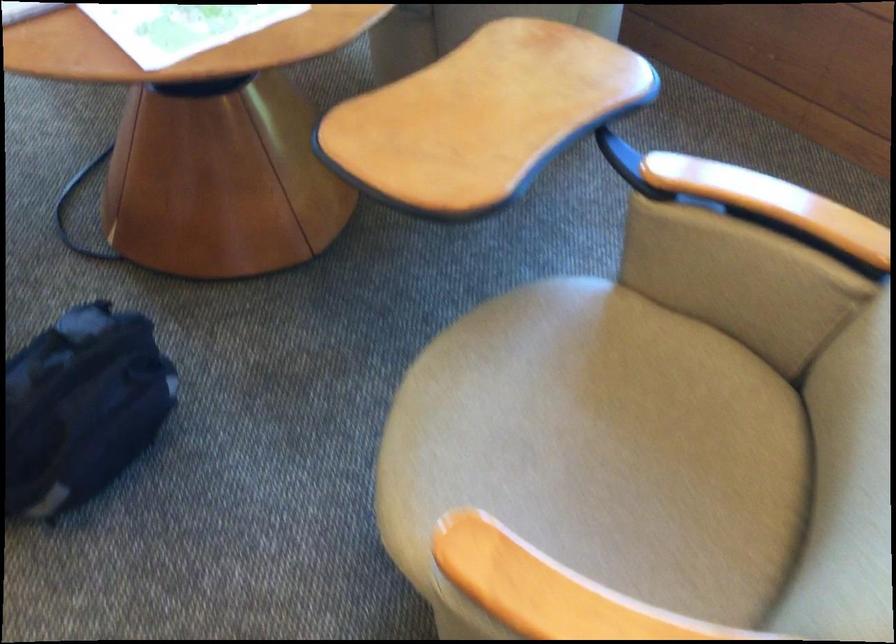
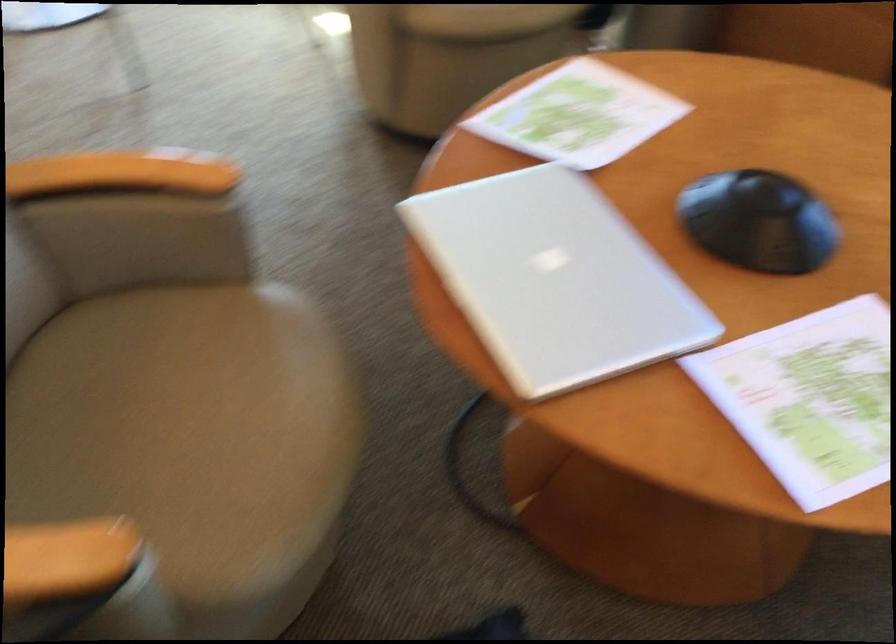
The images are taken continuously from a first-person perspective. In which direction are you moving?

The cameraman moved toward left, forward.